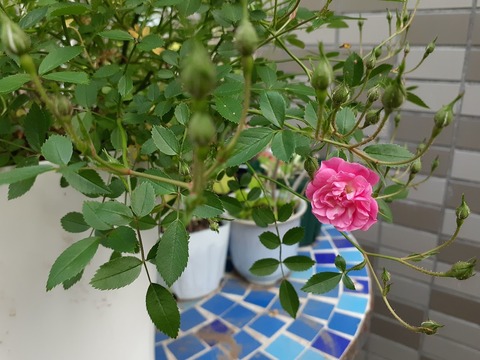
Image resolution: width=480 pixels, height=360 pixels. I want to click on tile wall, so click(467, 139).